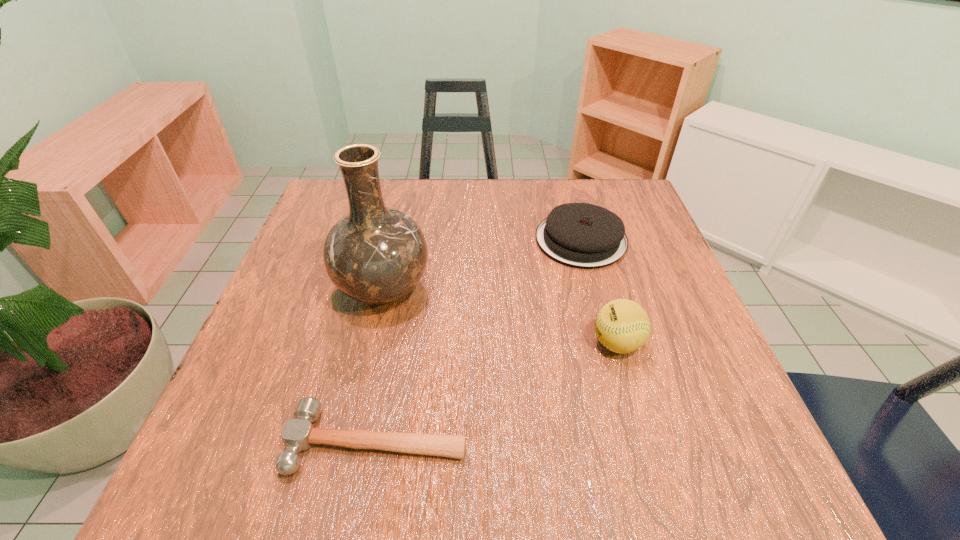
In the image, there is a desktop. Where is `free region at the near edge`? free region at the near edge is located at coordinates (588, 454).

I want to click on vacant space at the left edge of the desktop, so click(305, 309).

Locate an element on the screen. The height and width of the screenshot is (540, 960). vacant space at the right edge of the desktop is located at coordinates (628, 278).

The width and height of the screenshot is (960, 540). Identify the location of free spot at the far right corner of the desktop. (581, 188).

Find the location of a particular element. Image resolution: width=960 pixels, height=540 pixels. free space between the vase and the second shortest object is located at coordinates (482, 265).

Where is `vacant area that lies between the hammer and the third shortest object`? The height and width of the screenshot is (540, 960). vacant area that lies between the hammer and the third shortest object is located at coordinates (497, 392).

Where is `vacant point located between the nearest object and the softball`? This screenshot has width=960, height=540. vacant point located between the nearest object and the softball is located at coordinates (497, 392).

Identify the location of free space between the tallest object and the nearest object. This screenshot has height=540, width=960. [x=380, y=366].

You are a GUI agent. You are given a task and a screenshot of the screen. Output one action in this format:
    pyautogui.click(x=<x>, y=<y>)
    Task: Click on the unoccupied area between the tallest object and the softball
    The width and height of the screenshot is (960, 540).
    Given the screenshot: What is the action you would take?
    [500, 316]

The width and height of the screenshot is (960, 540). I want to click on vacant space that's between the shortest object and the third tallest object, so click(x=479, y=341).